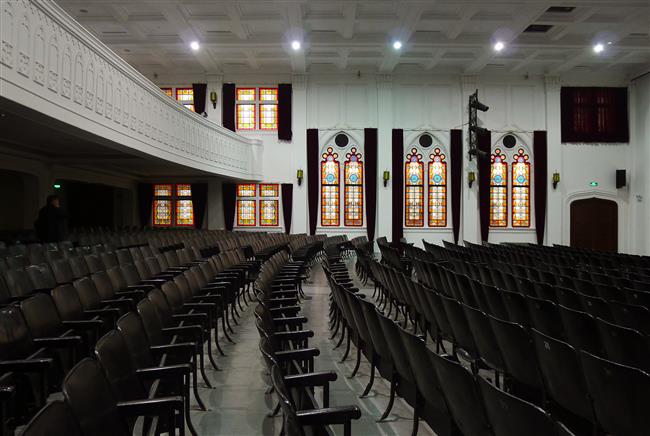
What are the coordinates of `overhead lighting` in the screenshot? It's located at (192, 45), (292, 45), (396, 45), (502, 42), (600, 47).